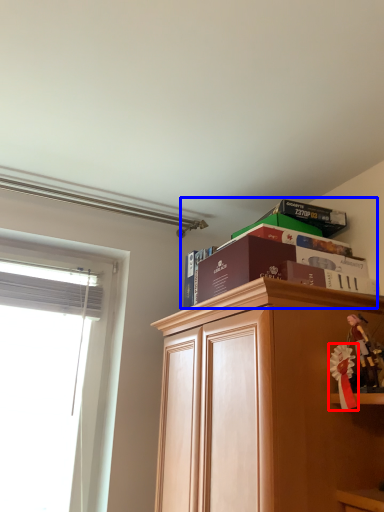
Question: Which object appears farthest to the camera in this image, toy (highlighted by a red box) or book (highlighted by a blue box)?

Choices:
 (A) toy
 (B) book

Answer: (B)